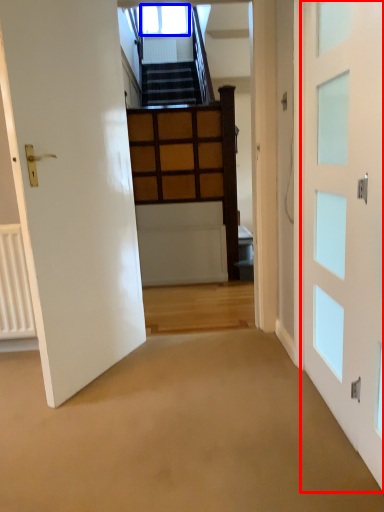
Question: Which object is further to the camera taking this photo, door (highlighted by a red box) or window (highlighted by a blue box)?

Choices:
 (A) door
 (B) window

Answer: (B)